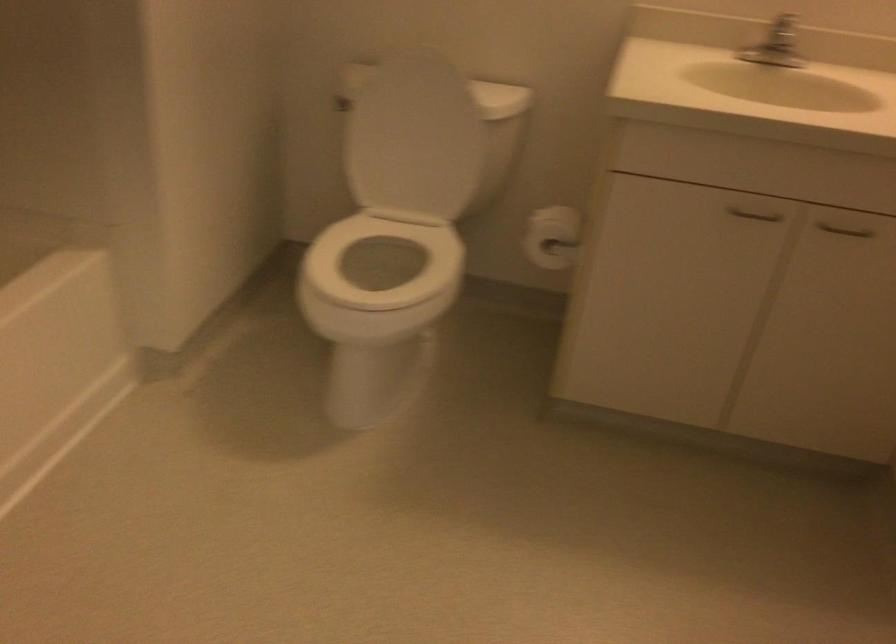
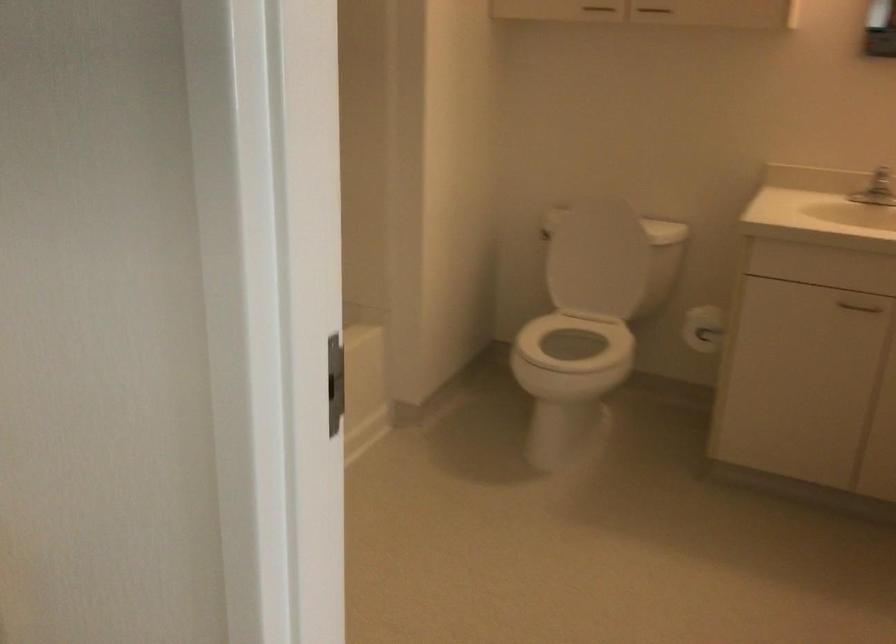
Locate, in the second image, the point that corresponds to point 418,136 in the first image.

(596, 258)